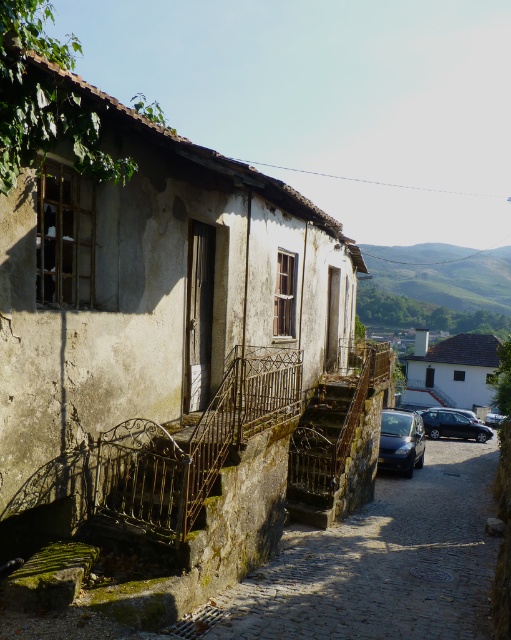
Question: Among these objects, which one is farthest from the camera?

Choices:
 (A) glossy black car at lower right
 (B) rusty metal stairs at lower left

Answer: (A)

Question: Is rusty metal stairs at lower left smaller than rusty metal stairs at center?

Choices:
 (A) yes
 (B) no

Answer: (B)

Question: Is rusty metal stairs at lower left to the right of rusty metal stairs at center from the viewer's perspective?

Choices:
 (A) no
 (B) yes

Answer: (B)

Question: Can you confirm if rusty metal stairs at lower left is bigger than satin black car at lower right?

Choices:
 (A) yes
 (B) no

Answer: (A)

Question: Which point is closer to the camera?

Choices:
 (A) rusty metal stairs at center
 (B) glossy black car at lower right
 (C) rusty metal stairs at lower left

Answer: (C)

Question: Considering the real-world distances, which object is farthest from the rusty metal stairs at lower left?

Choices:
 (A) rusty metal stairs at center
 (B) glossy black car at lower right

Answer: (B)